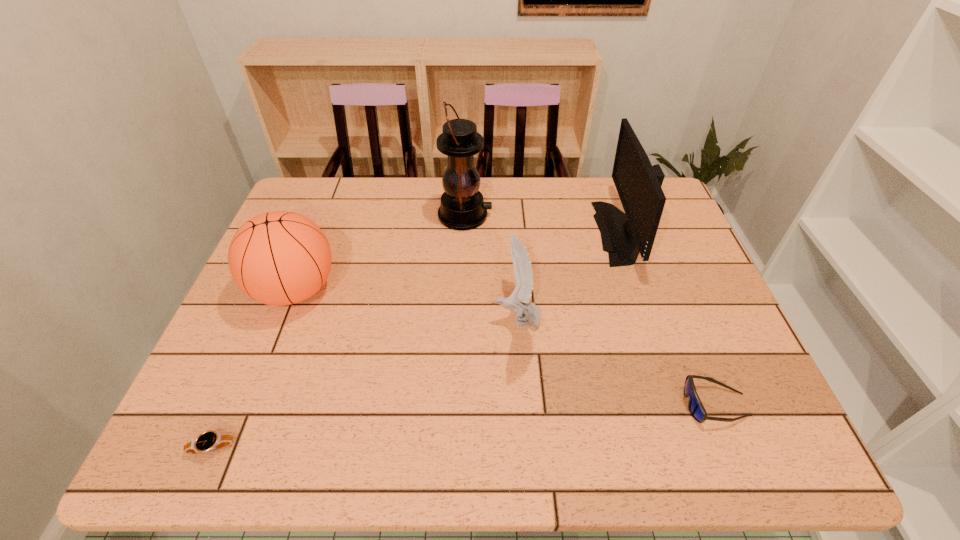
In order to click on lantern in this screenshot , I will do `click(462, 207)`.

This screenshot has height=540, width=960. Find the location of `monitor`. monitor is located at coordinates (638, 183).

The width and height of the screenshot is (960, 540). Identify the location of the third tallest object. (278, 258).

Locate an element on the screen. This screenshot has width=960, height=540. gull is located at coordinates (529, 313).

The height and width of the screenshot is (540, 960). Identify the location of sunglasses. pos(695,406).

Find the location of `the fifth tallest object`. the fifth tallest object is located at coordinates (695, 406).

Where is `watch`? watch is located at coordinates (210, 440).

The height and width of the screenshot is (540, 960). In order to click on the nearest object in this screenshot , I will do `click(210, 440)`.

Locate several points in vacant space located above the lantern, indicating its light source. Please provide its 2D coordinates. Your answer should be formatted as a tuple, i.e. [(x, y)], where the tuple contains the x and y coordinates of a point satisfying the conditions above.

[(570, 215)]

The image size is (960, 540). In order to click on blank area located 0.190m on the screen side of the second tallest object in this screenshot , I will do `click(533, 233)`.